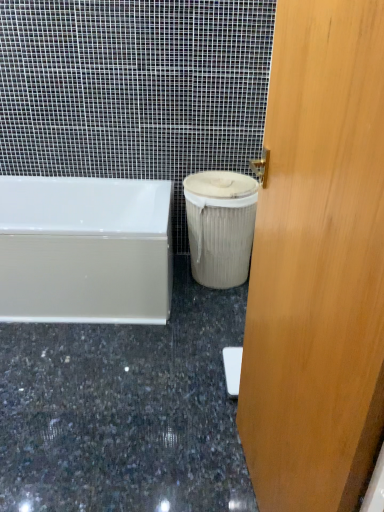
The image size is (384, 512). In order to click on free space in front of beige fabric trash can at lower right in this screenshot , I will do `click(192, 308)`.